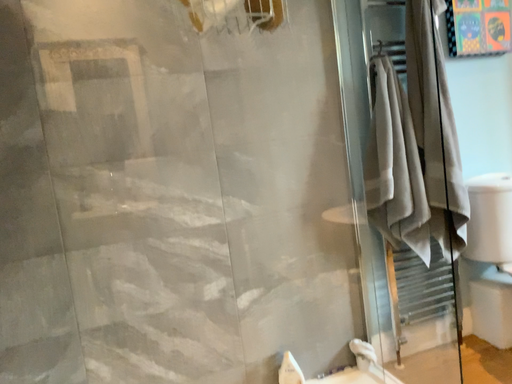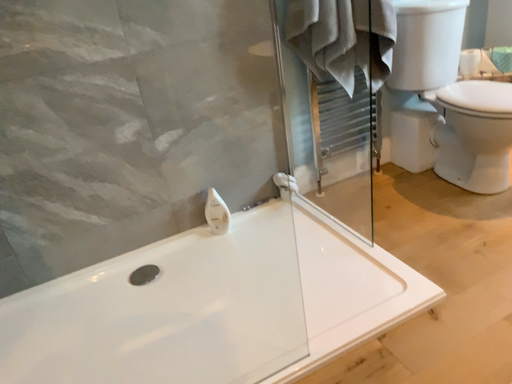
Question: How did the camera likely rotate when shooting the video?

Choices:
 (A) rotated left
 (B) rotated right

Answer: (B)